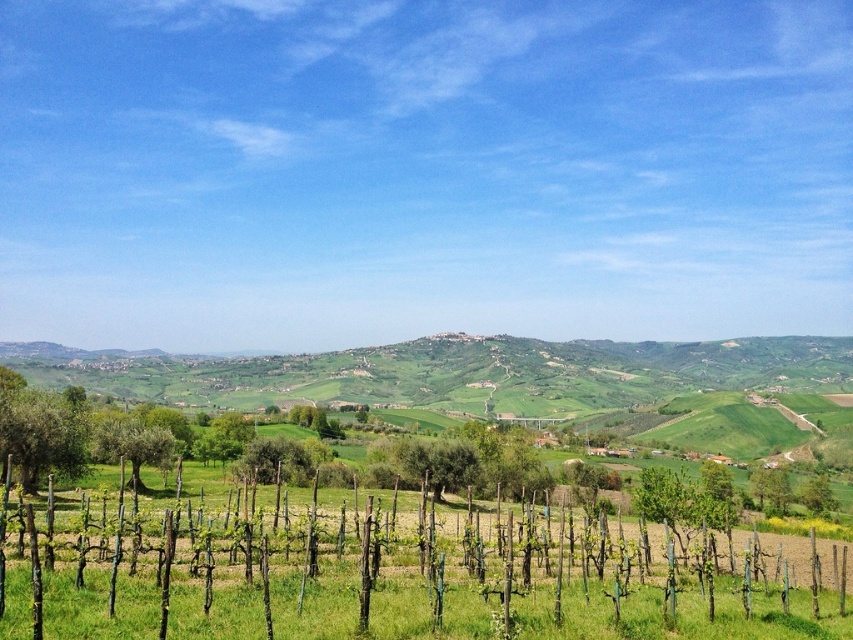
You are standing at the center of the vineyard and want to take a photo of the green leafy tree at lower left. Based on its coordinates, in which direction should you point your camera to capture it?

The green leafy tree at lower left is located at coordinates point (x=42, y=435), which means it is positioned to the right and slightly forward from your current position at the center of the vineyard. To capture it, you should point your camera to the right and slightly downward.

You are a hiker standing in the vineyard and see the green leafy tree at lower left and the green rough bark tree at left. Which tree is closer to you?

The green leafy tree at lower left is closer to you because it is positioned above the green rough bark tree at left, indicating it is in a lower section of the image, which typically corresponds to the foreground in such landscapes.